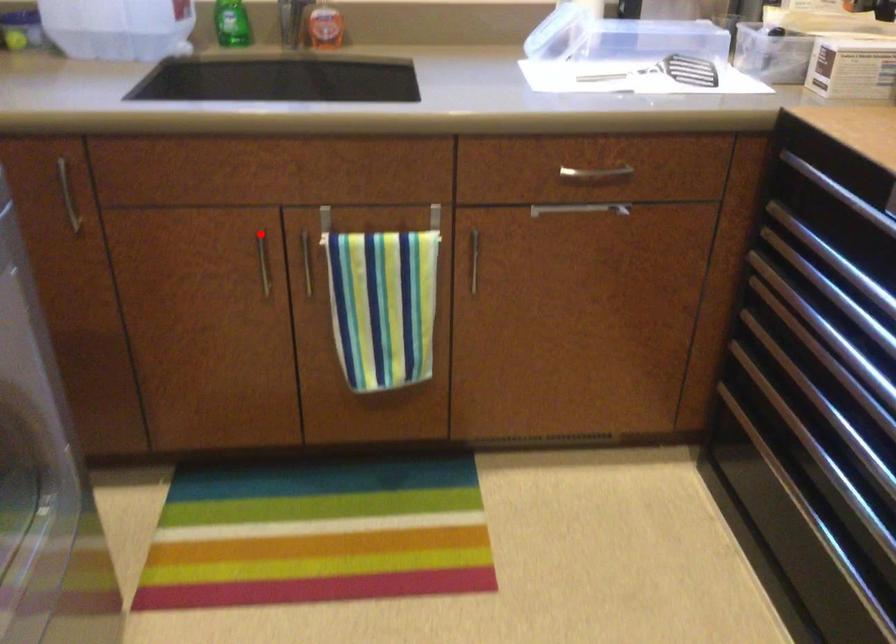
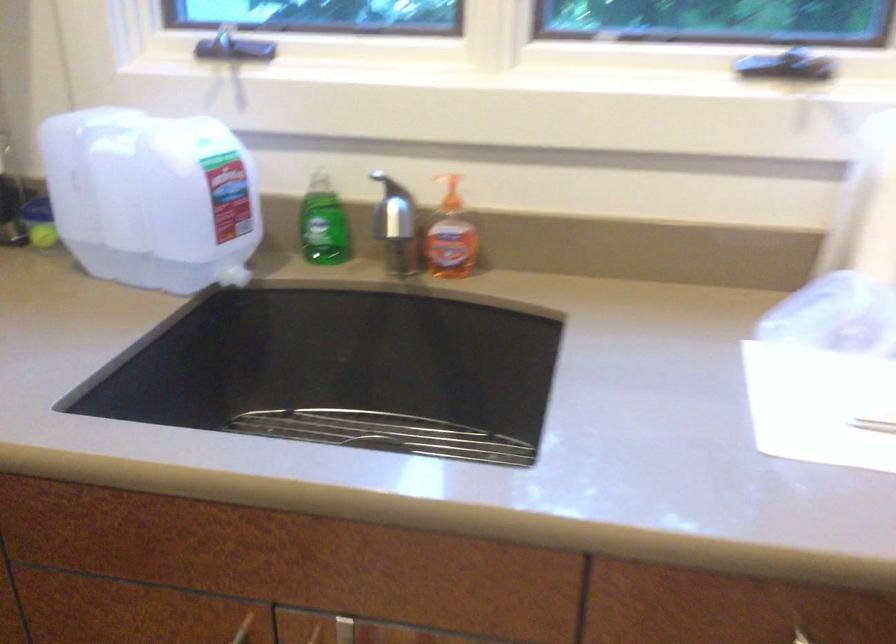
Find the pixel in the second image that matches the highlighted location in the first image.

(243, 629)